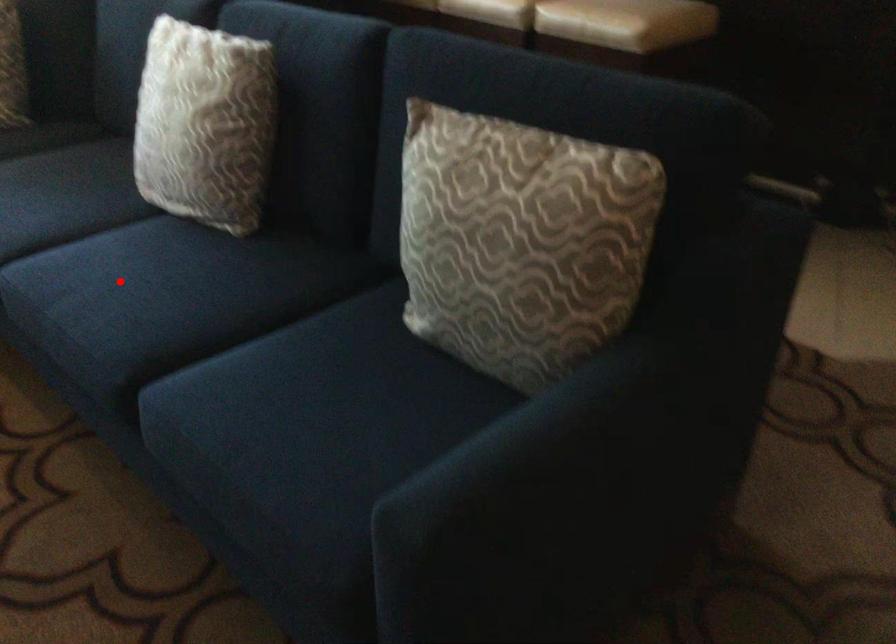
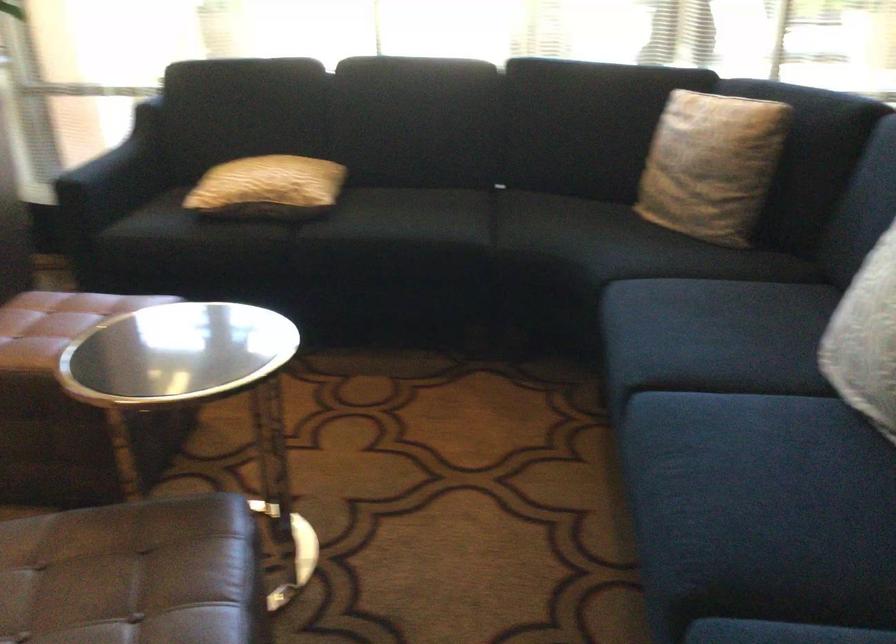
Find the pixel in the second image that matches the highlighted location in the first image.

(745, 459)